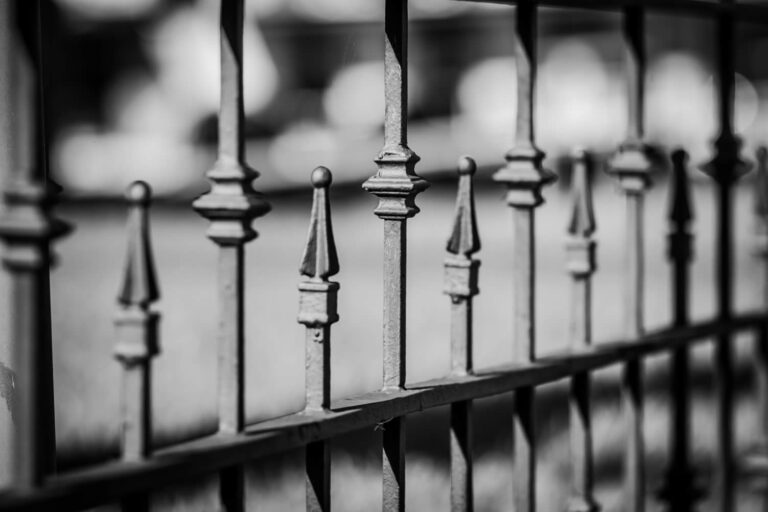
Locate an element on the screen. rod is located at coordinates (577, 324).